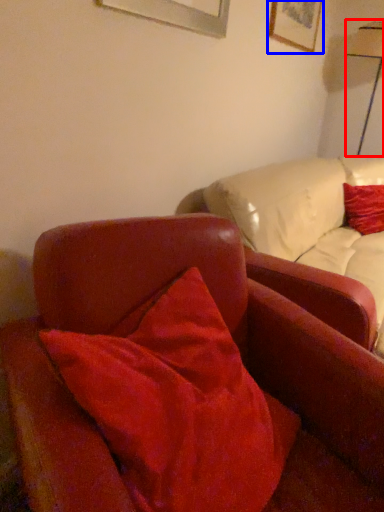
Question: Among these objects, which one is nearest to the camera, table lamp (highlighted by a red box) or picture frame (highlighted by a blue box)?

Choices:
 (A) table lamp
 (B) picture frame

Answer: (B)